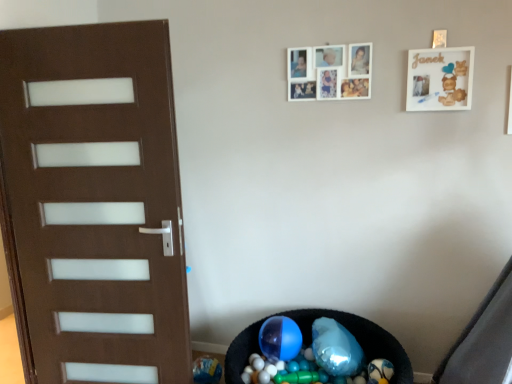
Question: Is the depth of white matte picture frame at upper center, which is the first picture frame from left to right, greater than that of white matte picture frame at upper right, the first picture frame viewed from the right?

Choices:
 (A) yes
 (B) no

Answer: (A)

Question: Is white matte picture frame at upper right, which appears as the second picture frame when viewed from the left, at the back of white matte picture frame at upper center, which is the first picture frame from left to right?

Choices:
 (A) no
 (B) yes

Answer: (A)

Question: Is white matte picture frame at upper center, which is the first picture frame from left to right, smaller than white matte picture frame at upper right, the first picture frame viewed from the right?

Choices:
 (A) yes
 (B) no

Answer: (B)

Question: Is white matte picture frame at upper center, which is the first picture frame from left to right, touching white matte picture frame at upper right, the first picture frame viewed from the right?

Choices:
 (A) no
 (B) yes

Answer: (A)

Question: Does white matte picture frame at upper center, acting as the second picture frame starting from the right, appear on the right side of white matte picture frame at upper right, which appears as the second picture frame when viewed from the left?

Choices:
 (A) no
 (B) yes

Answer: (A)

Question: Is white matte picture frame at upper center, which is the first picture frame from left to right, in front of or behind white matte picture frame at upper right, which appears as the second picture frame when viewed from the left, in the image?

Choices:
 (A) behind
 (B) front

Answer: (A)

Question: Considering the positions of white matte picture frame at upper center, which is the first picture frame from left to right, and white matte picture frame at upper right, which appears as the second picture frame when viewed from the left, in the image, is white matte picture frame at upper center, which is the first picture frame from left to right, bigger or smaller than white matte picture frame at upper right, which appears as the second picture frame when viewed from the left,?

Choices:
 (A) small
 (B) big

Answer: (B)

Question: From a real-world perspective, is white matte picture frame at upper center, which is the first picture frame from left to right, above or below white matte picture frame at upper right, the first picture frame viewed from the right?

Choices:
 (A) above
 (B) below

Answer: (A)

Question: Is white matte picture frame at upper center, which is the first picture frame from left to right, situated inside white matte picture frame at upper right, which appears as the second picture frame when viewed from the left, or outside?

Choices:
 (A) outside
 (B) inside

Answer: (A)

Question: From a real-world perspective, is translucent plastic balls at lower center positioned above or below white matte picture frame at upper right, the first picture frame viewed from the right?

Choices:
 (A) above
 (B) below

Answer: (B)

Question: Considering the positions of point (324, 370) and point (429, 61), is point (324, 370) closer or farther from the camera than point (429, 61)?

Choices:
 (A) farther
 (B) closer

Answer: (A)

Question: In terms of size, does translucent plastic balls at lower center appear bigger or smaller than white matte picture frame at upper right, the first picture frame viewed from the right?

Choices:
 (A) big
 (B) small

Answer: (A)

Question: Is translucent plastic balls at lower center wider or thinner than white matte picture frame at upper right, which appears as the second picture frame when viewed from the left?

Choices:
 (A) thin
 (B) wide

Answer: (B)

Question: Do you think translucent plastic balls at lower center is within white matte picture frame at upper center, acting as the second picture frame starting from the right, or outside of it?

Choices:
 (A) inside
 (B) outside

Answer: (B)

Question: Visually, is translucent plastic balls at lower center positioned to the left or to the right of white matte picture frame at upper center, acting as the second picture frame starting from the right?

Choices:
 (A) left
 (B) right

Answer: (A)